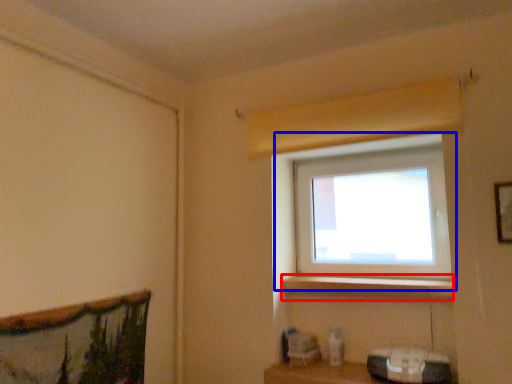
Question: Which point is further to the camera, window sill (highlighted by a red box) or window (highlighted by a blue box)?

Choices:
 (A) window sill
 (B) window

Answer: (B)